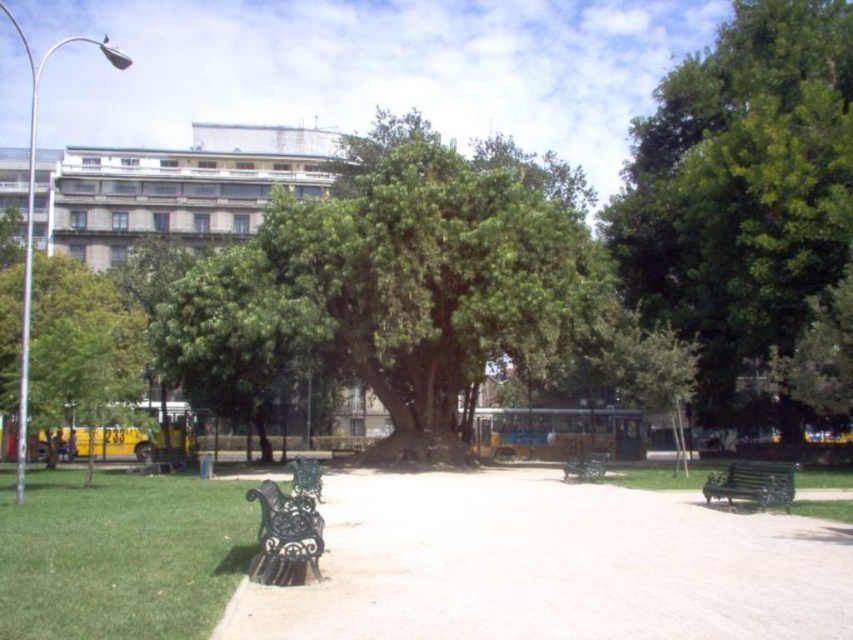
Is point (32, 525) positioned in front of point (579, 454)?

Yes, it is.

Does point (24, 509) come farther from viewer compared to point (585, 465)?

No, it is in front of (585, 465).

Who is more distant from viewer, (172,486) or (595,467)?

Point (595,467)

Locate an element on the screen. Image resolution: width=853 pixels, height=640 pixels. green grass at lower left is located at coordinates (120, 554).

Between green leafy tree at center and black wrought iron bench at center, which one is positioned higher?

green leafy tree at center is above.

Which is in front, point (694, 298) or point (589, 461)?

Point (589, 461) is in front.

At what (x,y) coordinates should I click in order to perform the action: click on green leafy tree at center. Please return your answer as a coordinate pair (x, y). Looking at the image, I should click on click(x=741, y=195).

Is smooth concrete pavement at center to the left of green wrought iron bench at lower right from the viewer's perspective?

Yes, smooth concrete pavement at center is to the left of green wrought iron bench at lower right.

Find the location of a particular element. The image size is (853, 640). smooth concrete pavement at center is located at coordinates (552, 564).

The width and height of the screenshot is (853, 640). What are the coordinates of `smooth concrete pavement at center` in the screenshot? It's located at (552, 564).